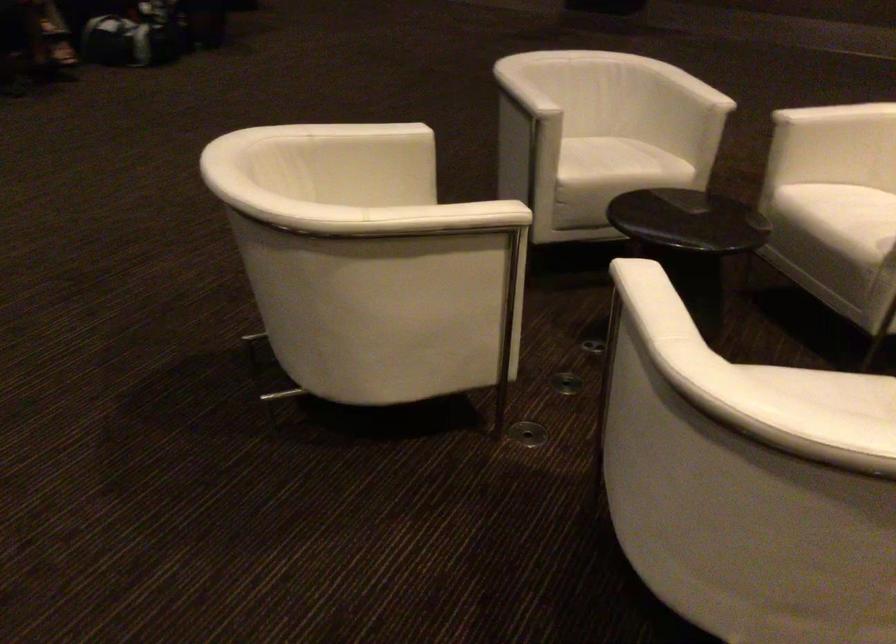
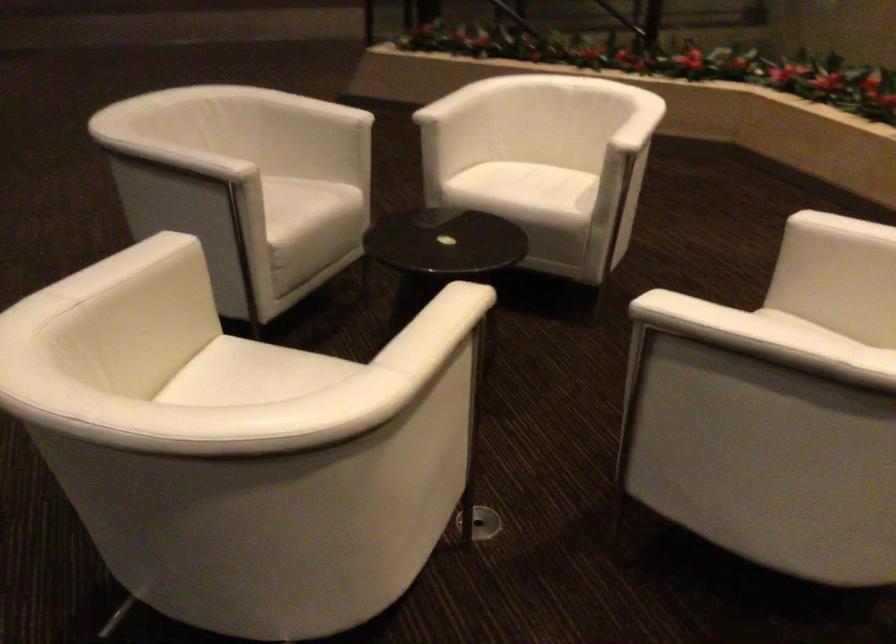
In the second image, find the point that corresponds to (x=618, y=156) in the first image.

(306, 205)